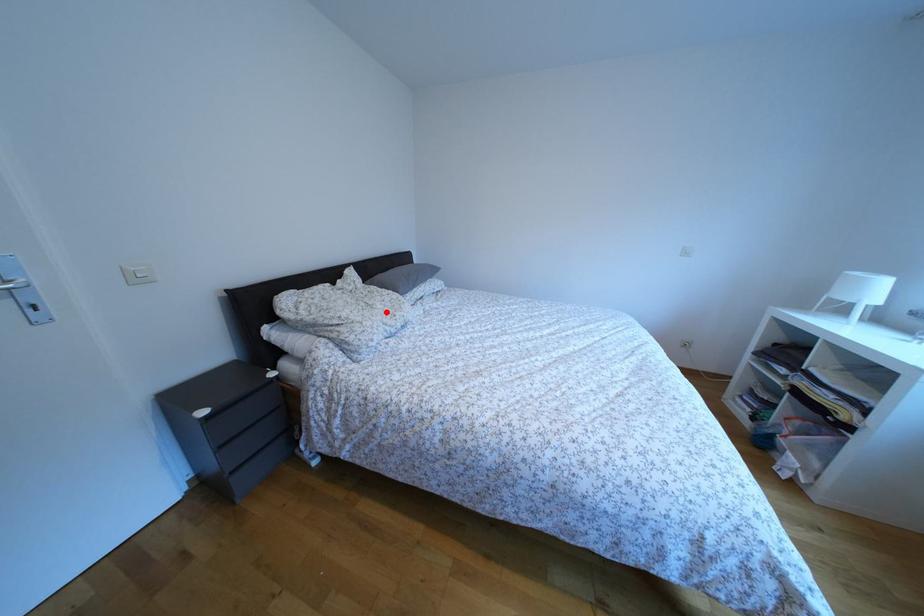
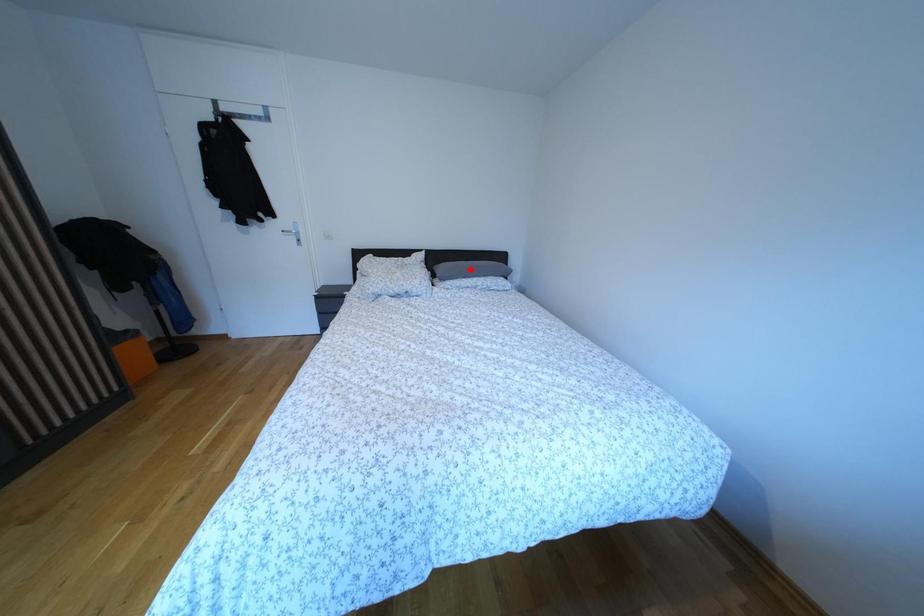
I am providing you with two images of the same scene from different viewpoints. A red point is marked on the first image and another point is marked on the second image. Does the point marked in image1 correspond to the same location as the one in image2?

No